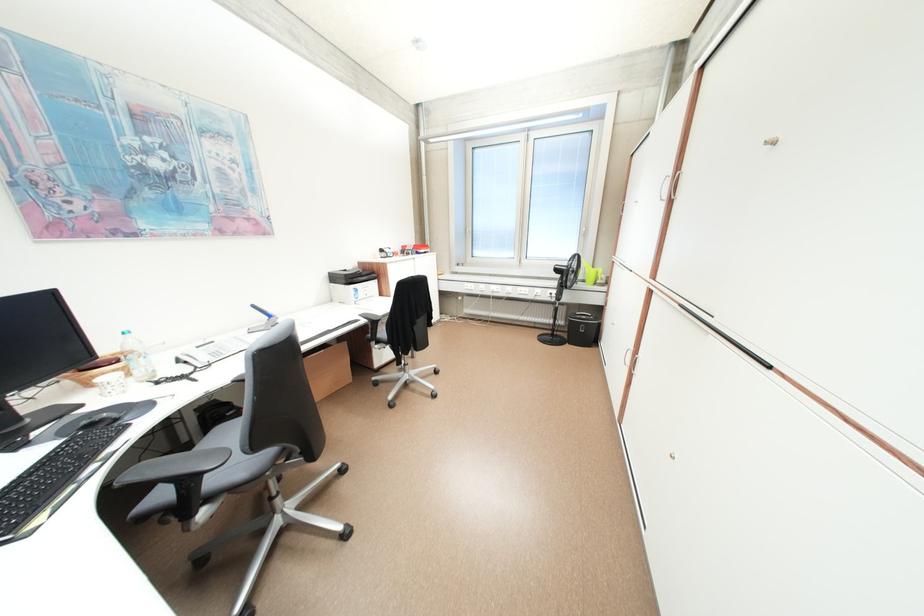
Find where to resting arm the black chair armrest. Please return your answer as a coordinate pair (x, y).

(371, 323)